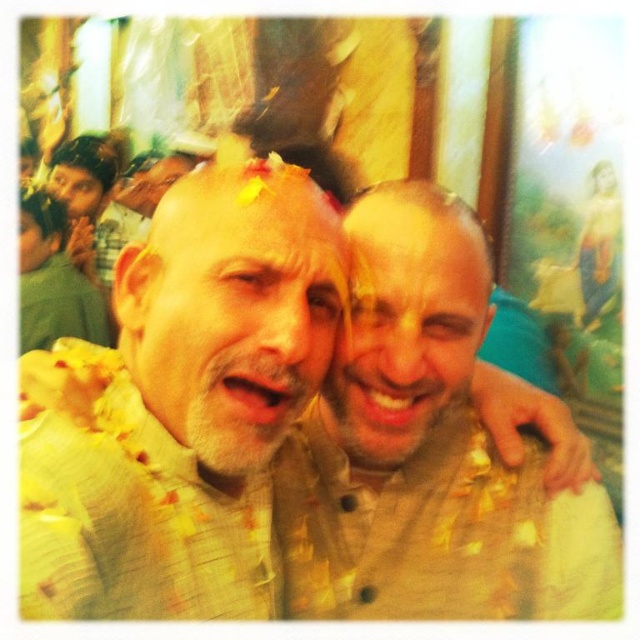
Does yellow glitter at center appear on the left side of brown matte beard at upper left?

Incorrect, yellow glitter at center is not on the left side of brown matte beard at upper left.

Which is more to the left, yellow glitter at center or brown matte beard at upper left?

Answer: brown matte beard at upper left is more to the left.

Does point (188, 200) come behind point (81, 198)?

No, (188, 200) is in front of (81, 198).

Locate an element on the screen. yellow glitter at center is located at coordinates (248, 202).

Does point (477, 268) lie behind point (193, 208)?

Yes, it is behind point (193, 208).

Can you confirm if smooth beige face at center is taller than yellow glitter at center?

Yes.

Between point (435, 356) and point (304, 182), which one is positioned behind?

Positioned behind is point (435, 356).

What are the coordinates of `smooth beige face at center` in the screenshot? It's located at (406, 333).

Is point (202, 308) less distant than point (260, 180)?

Yes, it is.

Describe the element at coordinates (236, 323) in the screenshot. I see `matte gold face at center` at that location.

Locate an element on the screen. matte gold face at center is located at coordinates (236, 323).

The image size is (640, 640). Find the location of `matte gold face at center`. matte gold face at center is located at coordinates (236, 323).